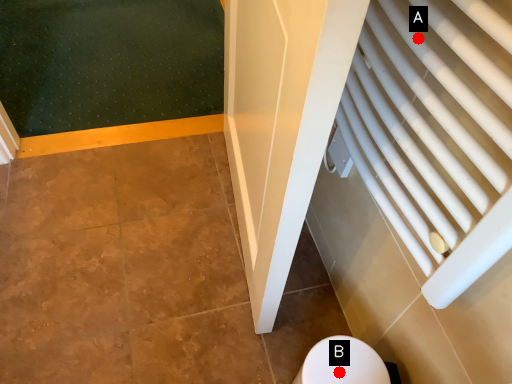
Question: Two points are circled on the image, labeled by A and B beside each circle. Among these points, which one is nearest to the camera?

Choices:
 (A) A is closer
 (B) B is closer

Answer: (A)